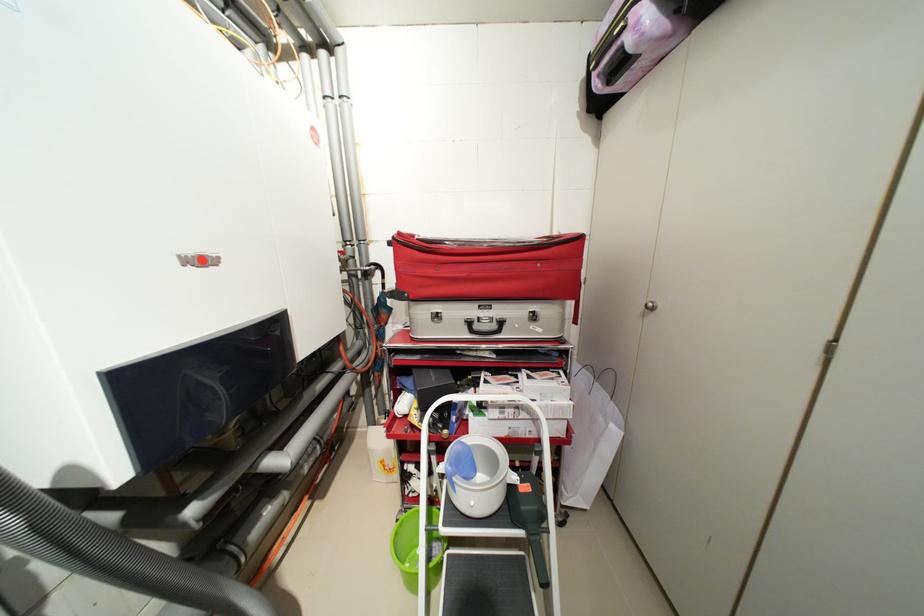
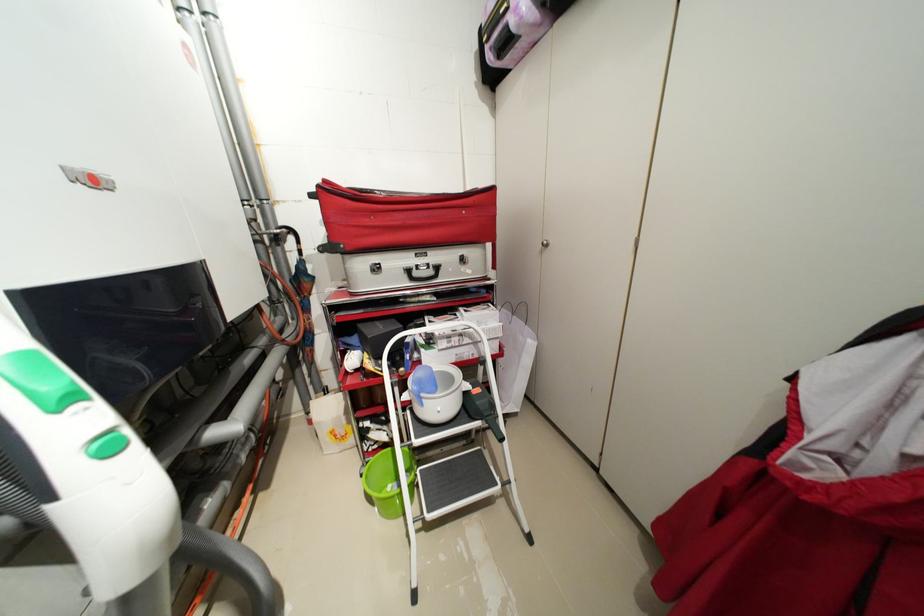
Where in the second image is the point corresponding to [404,535] from the first image?

(373, 479)